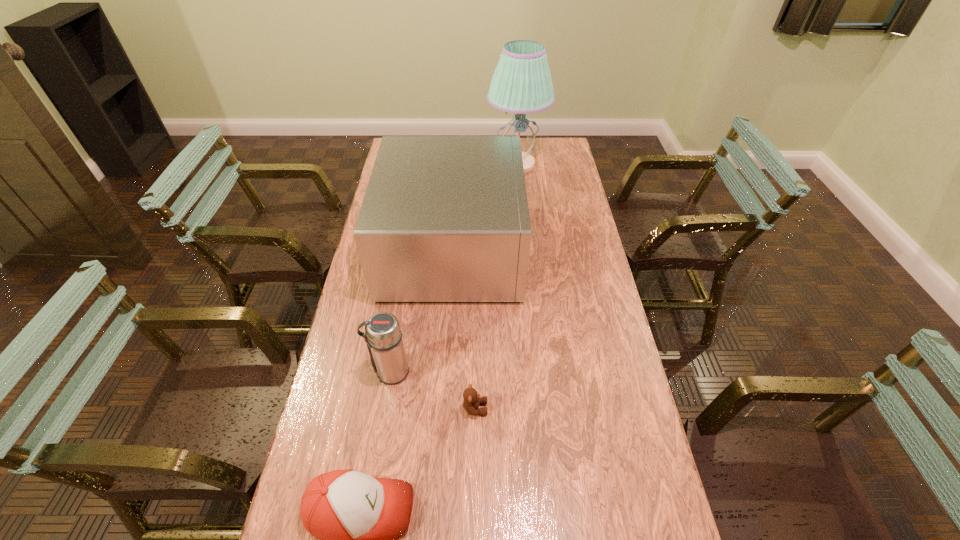
Find the location of a particular element. This screenshot has height=540, width=960. the second closest object to the microwave oven is located at coordinates (383, 336).

Select which object appears as the second closest to the teddy bear. Please provide its 2D coordinates. Your answer should be formatted as a tuple, i.e. [(x, y)], where the tuple contains the x and y coordinates of a point satisfying the conditions above.

[(358, 518)]